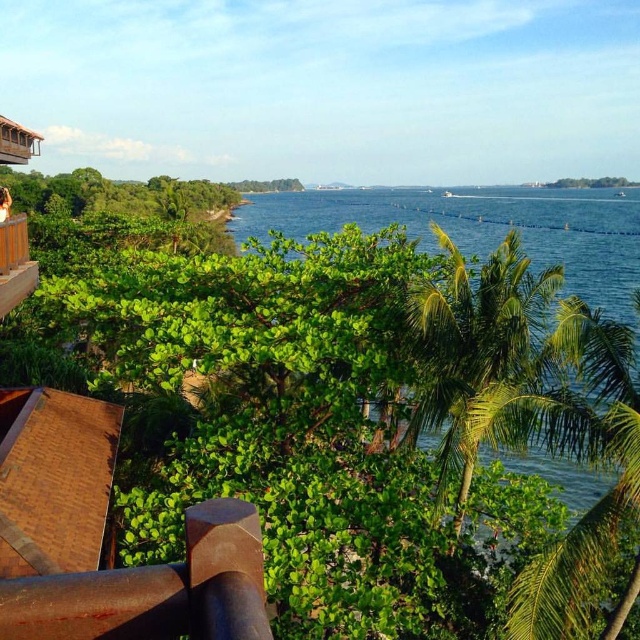
Question: Is green leafy bush at center closer to the viewer compared to green leafy palm tree at center?

Choices:
 (A) no
 (B) yes

Answer: (A)

Question: Which point is farther from the camera taking this photo?

Choices:
 (A) (13, 237)
 (B) (154, 593)
 (C) (604, 394)
 (D) (266, 227)

Answer: (D)

Question: Is green leafy bush at center below rusty metal stilt at lower left?

Choices:
 (A) no
 (B) yes

Answer: (A)

Question: Which object is positioned farthest from the green leafy bush at center?

Choices:
 (A) rusty metal stilt at lower left
 (B) brown wooden balcony at lower left

Answer: (B)

Question: In this image, where is green leafy palm tree at right located relative to green leafy palm tree at center?

Choices:
 (A) above
 (B) below

Answer: (B)

Question: Which point is farther to the camera?

Choices:
 (A) (17, 221)
 (B) (620, 337)
 (C) (8, 148)

Answer: (C)